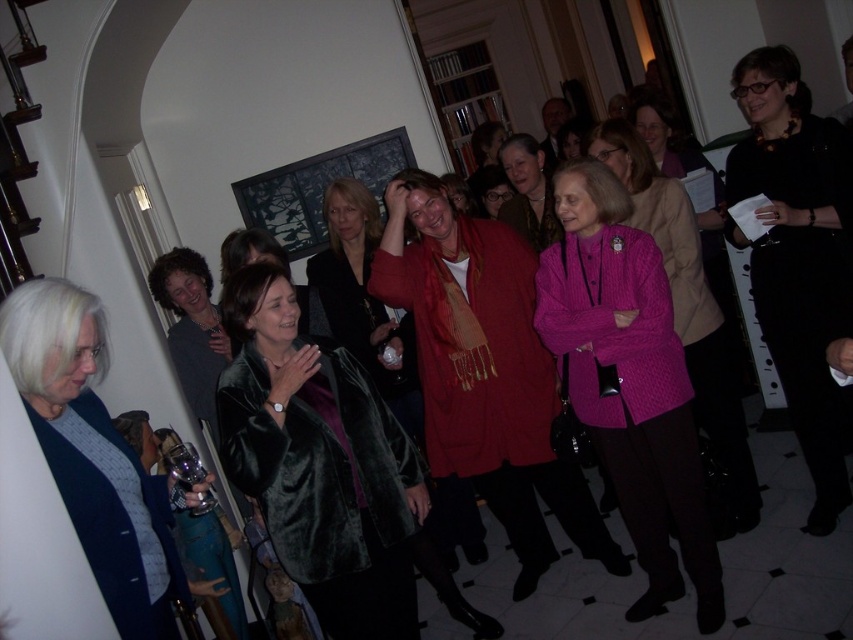
Question: Based on their relative distances, which object is farther from the velvet green coat at lower left?

Choices:
 (A) black velvet dress at center
 (B) knitted pink sweater at center

Answer: (A)

Question: Is velvet green coat at center wider than black velvet dress at center?

Choices:
 (A) yes
 (B) no

Answer: (B)

Question: Does black velvet dress at center appear on the left side of velvet green coat at lower left?

Choices:
 (A) yes
 (B) no

Answer: (B)

Question: Based on their relative distances, which object is nearer to the cable-knit sweater at center?

Choices:
 (A) velvet green coat at center
 (B) black velvet dress at center
 (C) knitted pink sweater at center
 (D) velvet green coat at lower left

Answer: (B)

Question: Where is velvet green coat at center located in relation to knitted pink sweater at center in the image?

Choices:
 (A) above
 (B) below

Answer: (B)

Question: Among these points, which one is nearest to the camera?

Choices:
 (A) (328, 625)
 (B) (691, 241)
 (C) (801, 424)
 (D) (665, 342)

Answer: (A)